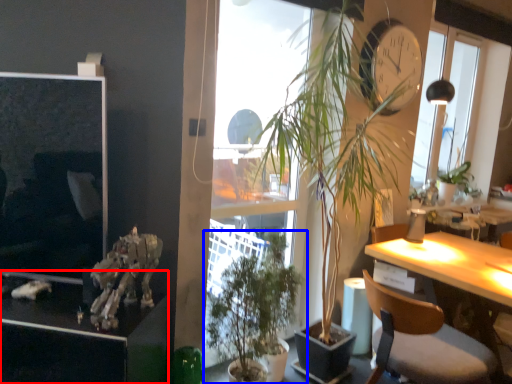
Question: Which object is further to the camera taking this photo, cabinetry (highlighted by a red box) or houseplant (highlighted by a blue box)?

Choices:
 (A) cabinetry
 (B) houseplant

Answer: (B)